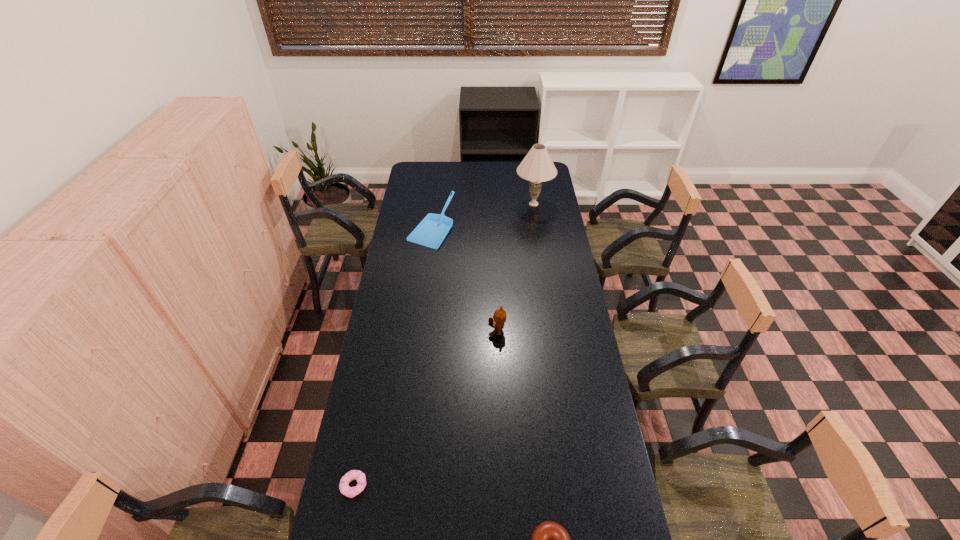
The image size is (960, 540). Find the location of `the tallest object`. the tallest object is located at coordinates (537, 166).

The width and height of the screenshot is (960, 540). Find the location of `the third object from right to left`. the third object from right to left is located at coordinates (498, 319).

Identify the location of the third nearest object. (498, 319).

At what (x,y) coordinates should I click in order to perform the action: click on dustpan. Please return your answer as a coordinate pair (x, y). The height and width of the screenshot is (540, 960). Looking at the image, I should click on (432, 230).

Where is `the second nearest object`? This screenshot has height=540, width=960. the second nearest object is located at coordinates (x=345, y=489).

In order to click on the farther doughnut in this screenshot , I will do `click(345, 489)`.

At what (x,y) coordinates should I click in order to perform the action: click on vacant area located 0.090m on the left of the lampshade. Please return your answer as a coordinate pair (x, y). This screenshot has width=960, height=540. Looking at the image, I should click on click(498, 204).

At what (x,y) coordinates should I click in order to perform the action: click on free spot located on the front-facing side of the third nearest object. Please return your answer as a coordinate pair (x, y). Image resolution: width=960 pixels, height=540 pixels. Looking at the image, I should click on (404, 329).

Where is `free space located 0.220m on the front-facing side of the third nearest object`? free space located 0.220m on the front-facing side of the third nearest object is located at coordinates (435, 329).

Identify the location of vacant space located 0.310m on the front-facing side of the third nearest object. The image size is (960, 540). (414, 329).